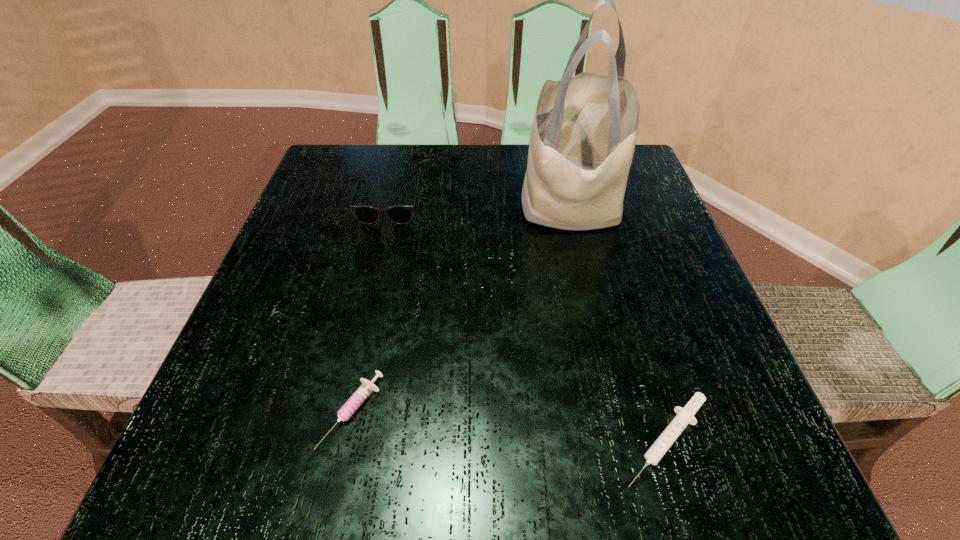
Where is `object situated at the left edge`? The height and width of the screenshot is (540, 960). object situated at the left edge is located at coordinates (401, 214).

Image resolution: width=960 pixels, height=540 pixels. Find the location of `shopping bag that is positioned at the right edge`. shopping bag that is positioned at the right edge is located at coordinates (583, 136).

Find the location of a particular element. The image size is (960, 540). syringe that is at the right edge is located at coordinates (685, 416).

The width and height of the screenshot is (960, 540). I want to click on object that is positioned at the far left corner, so click(x=401, y=214).

This screenshot has height=540, width=960. In order to click on object that is at the far right corner in this screenshot , I will do `click(583, 136)`.

Locate an element on the screen. The width and height of the screenshot is (960, 540). object that is positioned at the near right corner is located at coordinates (685, 416).

Where is `free space at the far edge of the desktop`? free space at the far edge of the desktop is located at coordinates (409, 176).

Locate an element on the screen. The image size is (960, 540). vacant region at the near edge of the desktop is located at coordinates (603, 436).

Identify the location of vacant area at the left edge. The height and width of the screenshot is (540, 960). [x=316, y=237].

The width and height of the screenshot is (960, 540). I want to click on free space at the right edge of the desktop, so click(x=657, y=321).